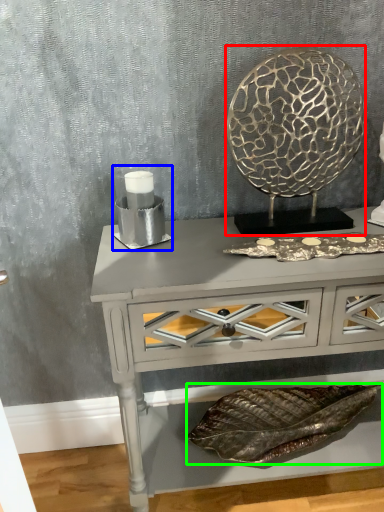
Question: Which object is the closest to the round table (highlighted by a red box)? Choose among these: candle holder (highlighted by a blue box) or material (highlighted by a green box).

Choices:
 (A) candle holder
 (B) material

Answer: (A)